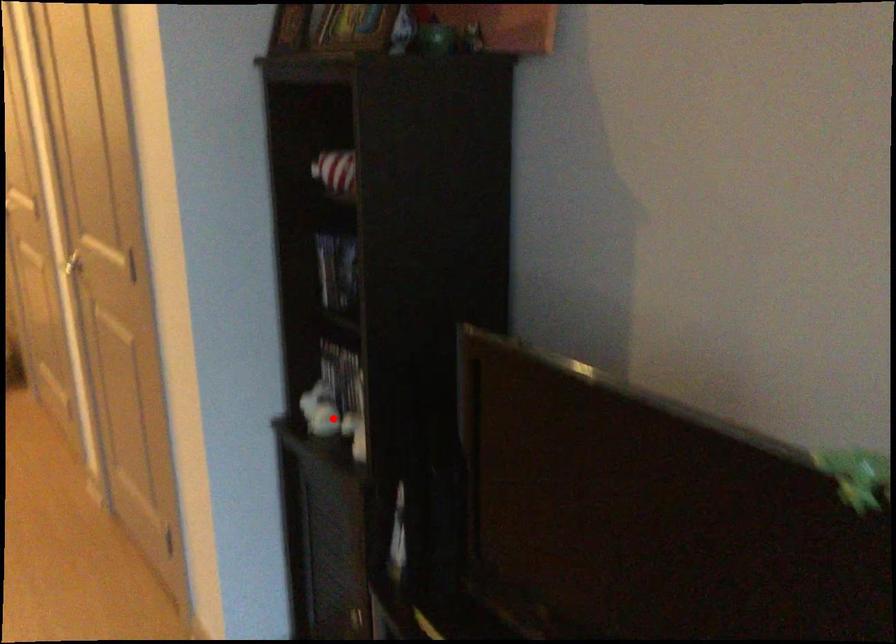
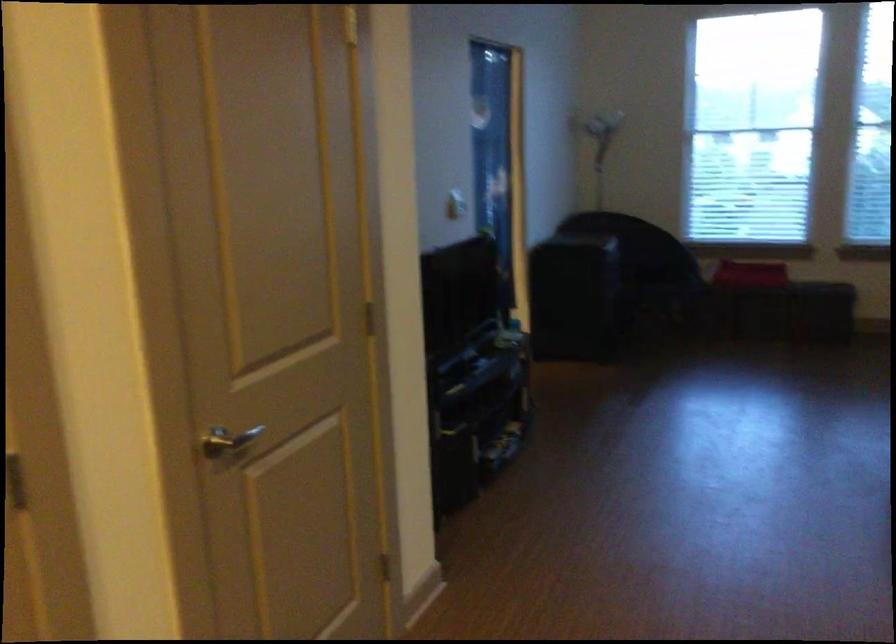
Question: I am providing you with two images of the same scene from different viewpoints. A red point is marked on the first image. Can you still see the location of the red point in image 2?

Choices:
 (A) Yes
 (B) No

Answer: (B)